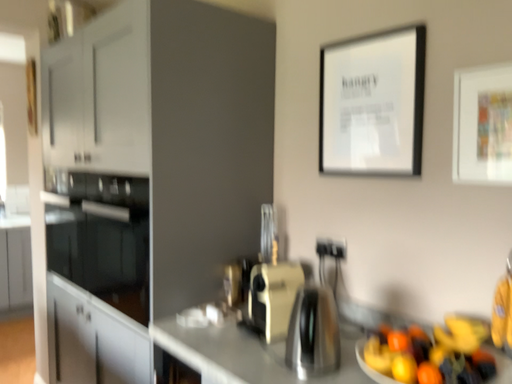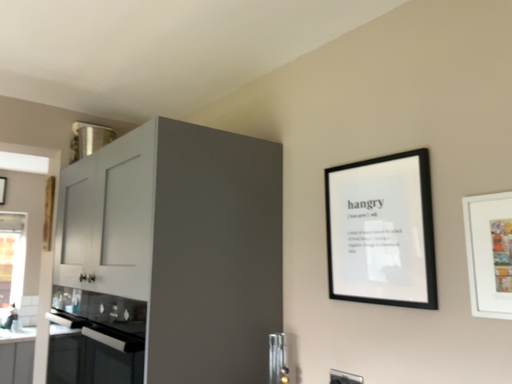
Question: How did the camera likely rotate when shooting the video?

Choices:
 (A) rotated upward
 (B) rotated downward

Answer: (A)